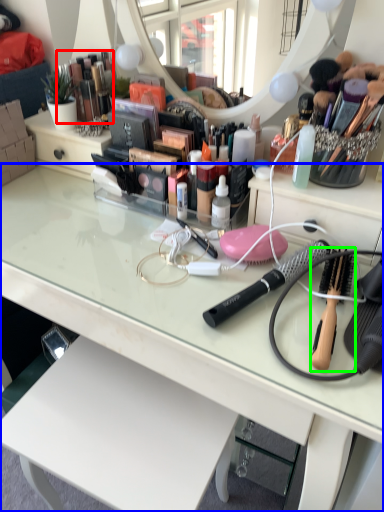
Question: Estimate the real-world distances between objects in this image. Which object is farther from toiletry (highlighted by a red box), desk (highlighted by a blue box) or brush (highlighted by a green box)?

Choices:
 (A) desk
 (B) brush

Answer: (B)